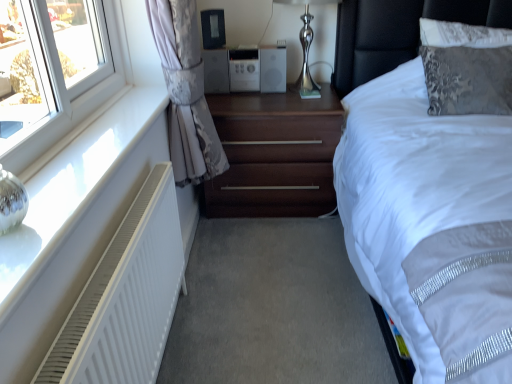
I want to click on vacant space in shiny metallic table lamp at upper center (from a real-world perspective), so click(294, 93).